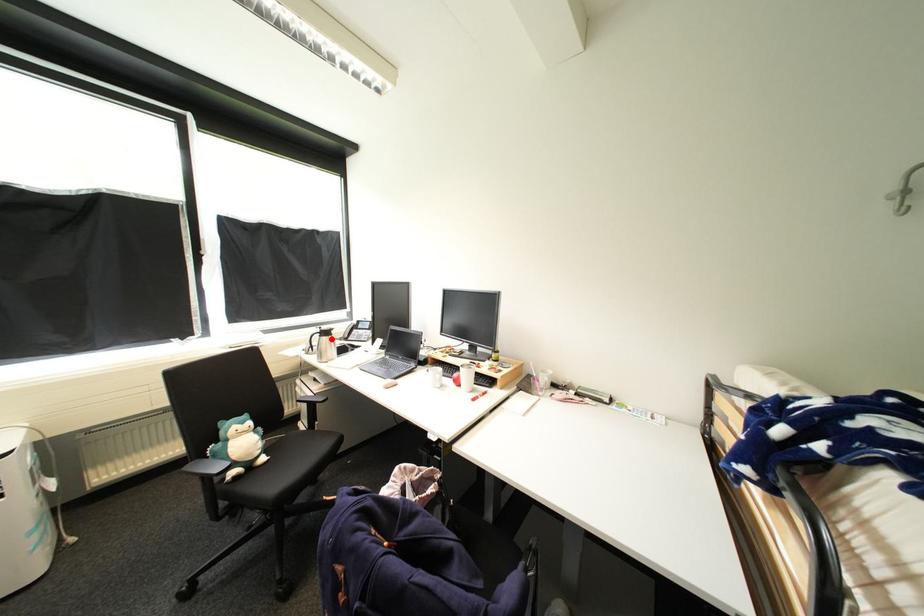
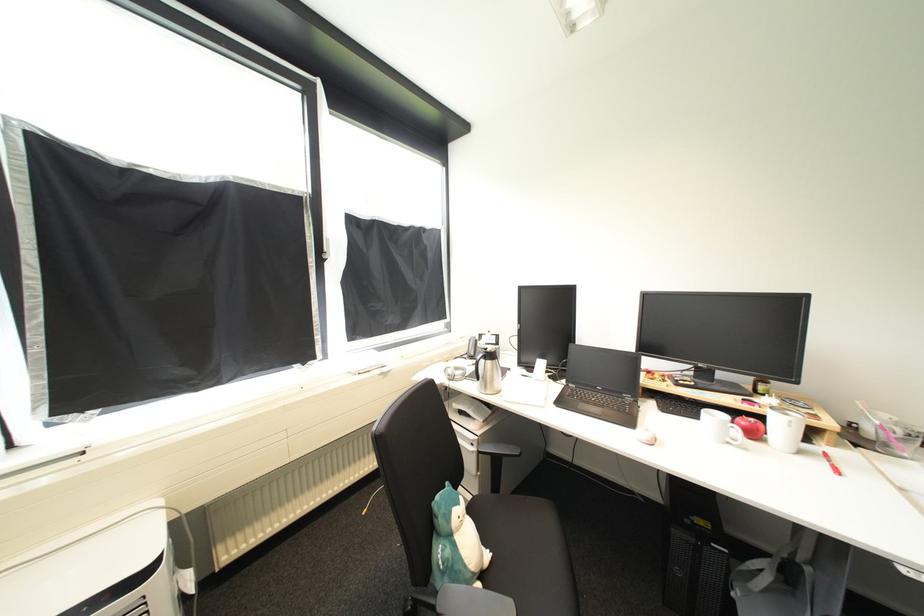
In the second image, find the point that corresponds to the highlighted location in the first image.

(495, 363)